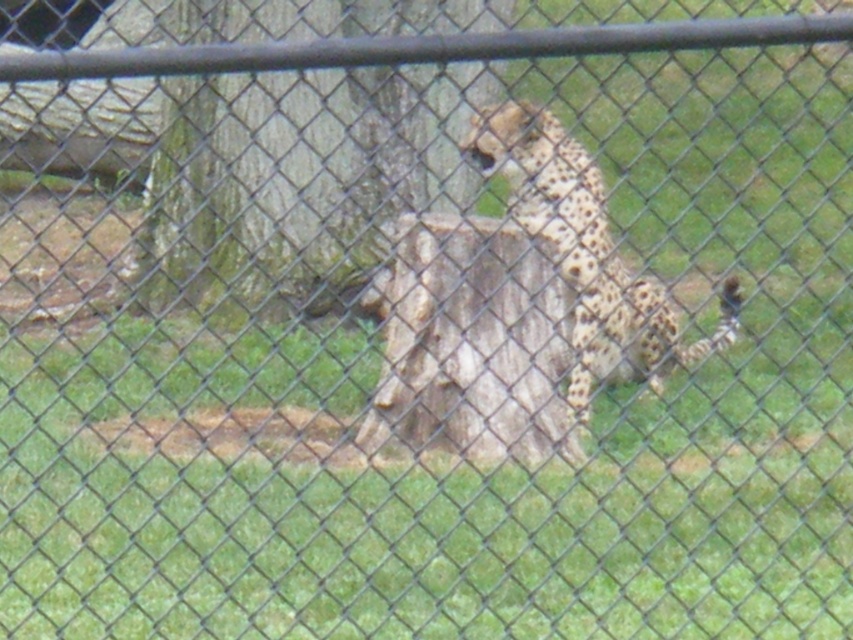
You are a zookeeper trying to locate the spotted fur cheetah at center in its enclosure. According to the scene, where would you find the rough bark tree stump at center relative to the cheetah?

The rough bark tree stump at center is to the left of the spotted fur cheetah at center.

You are a zookeeper trying to determine the best spot to place a new feeding tray. The tray requires a space wider than the spotted fur cheetah at center. Based on the enclosure layout shown, is the rough bark tree stump at center a suitable location for placing the feeding tray?

The rough bark tree stump at center has a width larger than the spotted fur cheetah at center, so it can accommodate the feeding tray requiring a space wider than the cheetah.